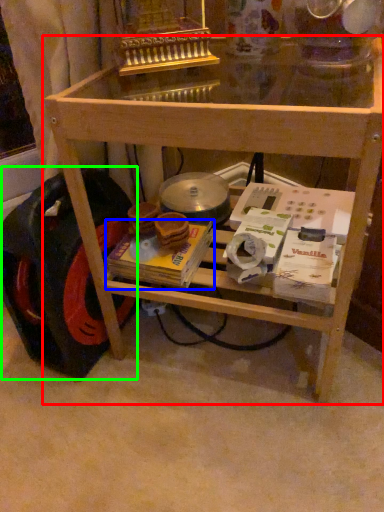
Question: Estimate the real-world distances between objects in this image. Which object is closer to table (highlighted by a red box), magazine (highlighted by a blue box) or wheel (highlighted by a green box)?

Choices:
 (A) magazine
 (B) wheel

Answer: (B)